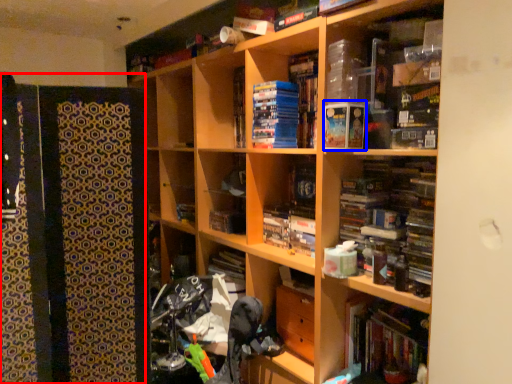
Question: Which of the following is the closest to the observer, cabinet (highlighted by a red box) or paperback book (highlighted by a blue box)?

Choices:
 (A) cabinet
 (B) paperback book

Answer: (A)